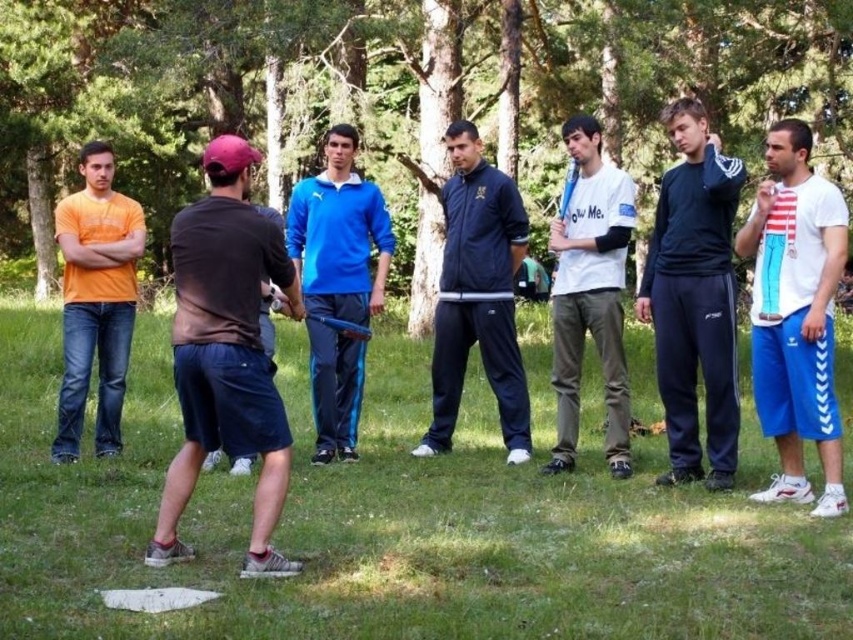
Can you confirm if orange t-shirt at left is bigger than dark gray fabric shirt at center?

Indeed, orange t-shirt at left has a larger size compared to dark gray fabric shirt at center.

Does orange t-shirt at left appear on the left side of dark gray fabric shirt at center?

Correct, you'll find orange t-shirt at left to the left of dark gray fabric shirt at center.

Describe the element at coordinates (96, 300) in the screenshot. I see `orange t-shirt at left` at that location.

In order to click on orange t-shirt at left in this screenshot , I will do `click(96, 300)`.

Does dark brown cotton t-shirt at center have a smaller size compared to dark blue track pants at center?

Yes, dark brown cotton t-shirt at center is smaller than dark blue track pants at center.

Between dark brown cotton t-shirt at center and dark blue track pants at center, which one has less height?

dark brown cotton t-shirt at center is shorter.

Locate an element on the screen. The width and height of the screenshot is (853, 640). dark brown cotton t-shirt at center is located at coordinates (225, 353).

Can you confirm if navy blue tracksuit at center is shorter than blue track suit at center?

Incorrect, navy blue tracksuit at center's height does not fall short of blue track suit at center's.

Is point (476, 202) closer to camera compared to point (318, 326)?

No, it is not.

Find the location of a particular element. This screenshot has height=640, width=853. navy blue tracksuit at center is located at coordinates (477, 296).